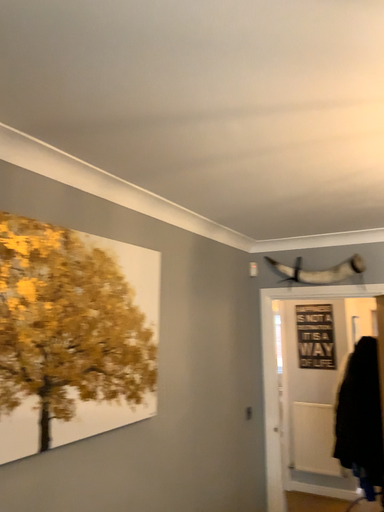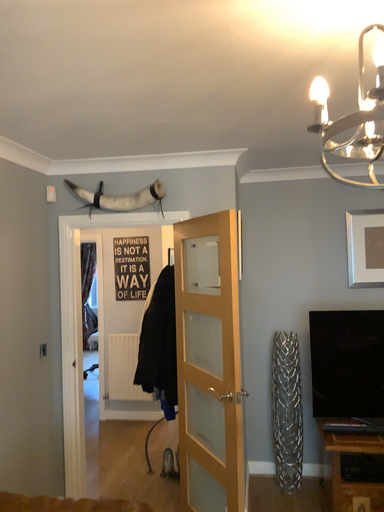
Question: How did the camera likely rotate when shooting the video?

Choices:
 (A) rotated left
 (B) rotated right

Answer: (B)